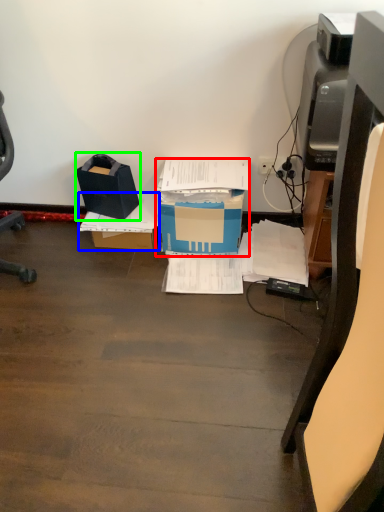
Question: Which object is the closest to the box (highlighted by a red box)? Choose among these: cardboard box (highlighted by a blue box) or box (highlighted by a green box).

Choices:
 (A) cardboard box
 (B) box

Answer: (A)